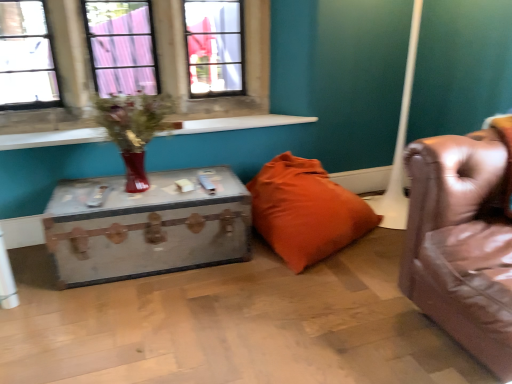
Question: Can you confirm if rustic wood trunk at center is taller than orange fabric pillow at center?

Choices:
 (A) yes
 (B) no

Answer: (B)

Question: Is rustic wood trunk at center smaller than orange fabric pillow at center?

Choices:
 (A) yes
 (B) no

Answer: (A)

Question: Can we say rustic wood trunk at center lies outside orange fabric pillow at center?

Choices:
 (A) no
 (B) yes

Answer: (B)

Question: Does rustic wood trunk at center appear on the left side of orange fabric pillow at center?

Choices:
 (A) yes
 (B) no

Answer: (A)

Question: Is there a large distance between rustic wood trunk at center and orange fabric pillow at center?

Choices:
 (A) yes
 (B) no

Answer: (B)

Question: Is rustic wood trunk at center to the right of orange fabric pillow at center from the viewer's perspective?

Choices:
 (A) yes
 (B) no

Answer: (B)

Question: From a real-world perspective, is rustic wood trunk at center on top of white smooth window sill at upper left?

Choices:
 (A) no
 (B) yes

Answer: (A)

Question: Considering the relative sizes of rustic wood trunk at center and white smooth window sill at upper left in the image provided, is rustic wood trunk at center shorter than white smooth window sill at upper left?

Choices:
 (A) yes
 (B) no

Answer: (B)

Question: Can you confirm if rustic wood trunk at center is positioned to the right of white smooth window sill at upper left?

Choices:
 (A) no
 (B) yes

Answer: (A)

Question: Considering the relative sizes of rustic wood trunk at center and white smooth window sill at upper left in the image provided, is rustic wood trunk at center bigger than white smooth window sill at upper left?

Choices:
 (A) yes
 (B) no

Answer: (A)

Question: From the image's perspective, is rustic wood trunk at center above white smooth window sill at upper left?

Choices:
 (A) yes
 (B) no

Answer: (B)

Question: Is rustic wood trunk at center aimed at white smooth window sill at upper left?

Choices:
 (A) yes
 (B) no

Answer: (B)

Question: Is orange fabric pillow at center to the right of white smooth window sill at upper left from the viewer's perspective?

Choices:
 (A) yes
 (B) no

Answer: (A)